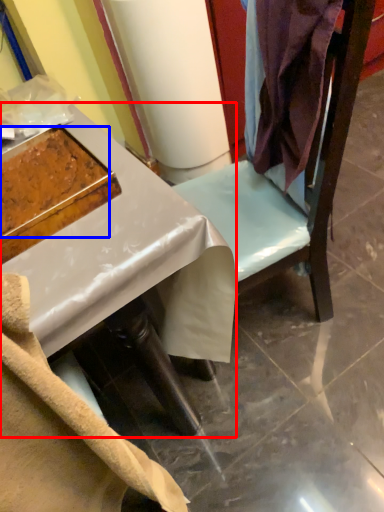
Question: Which point is further to the camera, desk (highlighted by a red box) or food (highlighted by a blue box)?

Choices:
 (A) desk
 (B) food

Answer: (B)